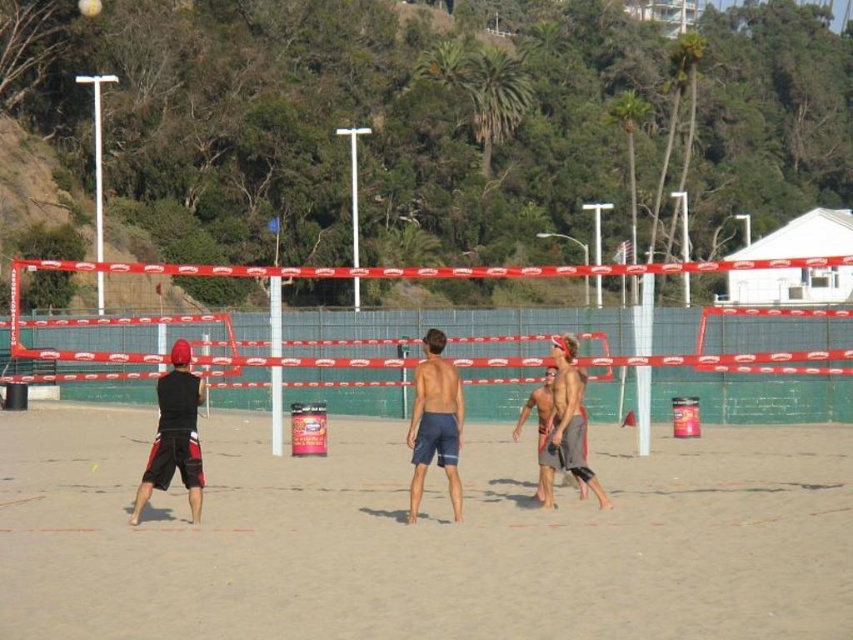
Question: Does tan skin shirtless man at center have a larger size compared to white matte volleyball at center?

Choices:
 (A) yes
 (B) no

Answer: (A)

Question: Which point is closer to the camera?

Choices:
 (A) (556, 465)
 (B) (194, 492)

Answer: (B)

Question: Among these objects, which one is farthest from the camera?

Choices:
 (A) black matte shorts at left
 (B) tan skin shirtless man at center
 (C) blue textured shorts at center

Answer: (B)

Question: Which point appears closest to the camera in this image?

Choices:
 (A) (83, 8)
 (B) (65, 444)
 (C) (172, 401)
 (D) (583, 420)

Answer: (C)

Question: Is sandy beach at center to the left of tan skin shirtless man at center from the viewer's perspective?

Choices:
 (A) yes
 (B) no

Answer: (A)

Question: Does black matte shorts at left come in front of matte gray shorts at center?

Choices:
 (A) no
 (B) yes

Answer: (B)